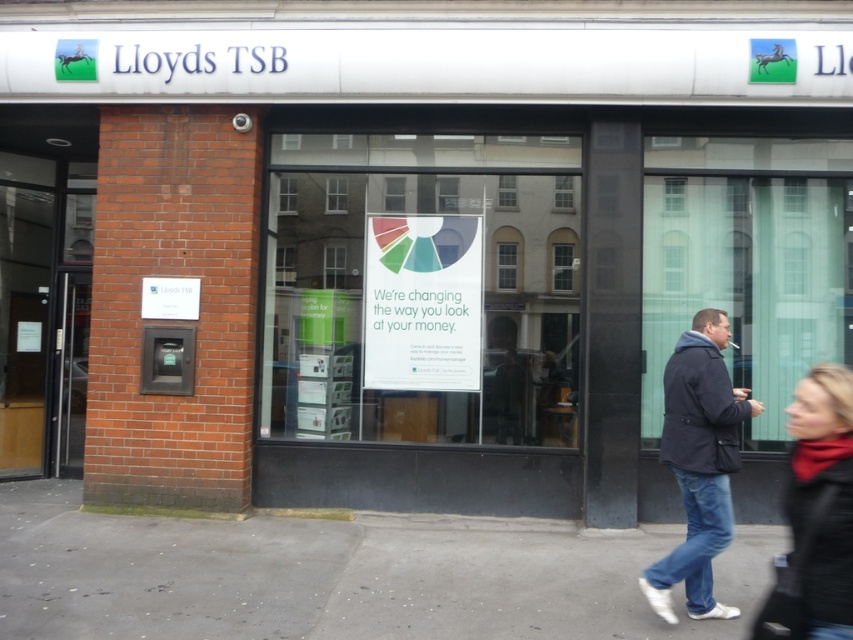
Question: Is gray concrete pavement at lower center further to camera compared to dark blue jacket at right?

Choices:
 (A) yes
 (B) no

Answer: (B)

Question: Does gray concrete pavement at lower center have a lesser width compared to black leather jacket at lower right?

Choices:
 (A) yes
 (B) no

Answer: (B)

Question: Among these points, which one is nearest to the camera?

Choices:
 (A) (724, 547)
 (B) (469, 268)

Answer: (A)

Question: Does dark blue jacket at right have a lesser width compared to black leather jacket at lower right?

Choices:
 (A) no
 (B) yes

Answer: (A)

Question: Which object is the farthest from the multicolored paper sign at center?

Choices:
 (A) dark blue jacket at right
 (B) black leather jacket at lower right
 (C) gray concrete pavement at lower center

Answer: (B)

Question: Estimate the real-world distances between objects in this image. Which object is closer to the black leather jacket at lower right?

Choices:
 (A) multicolored paper sign at center
 (B) dark blue jacket at right
 (C) gray concrete pavement at lower center

Answer: (B)